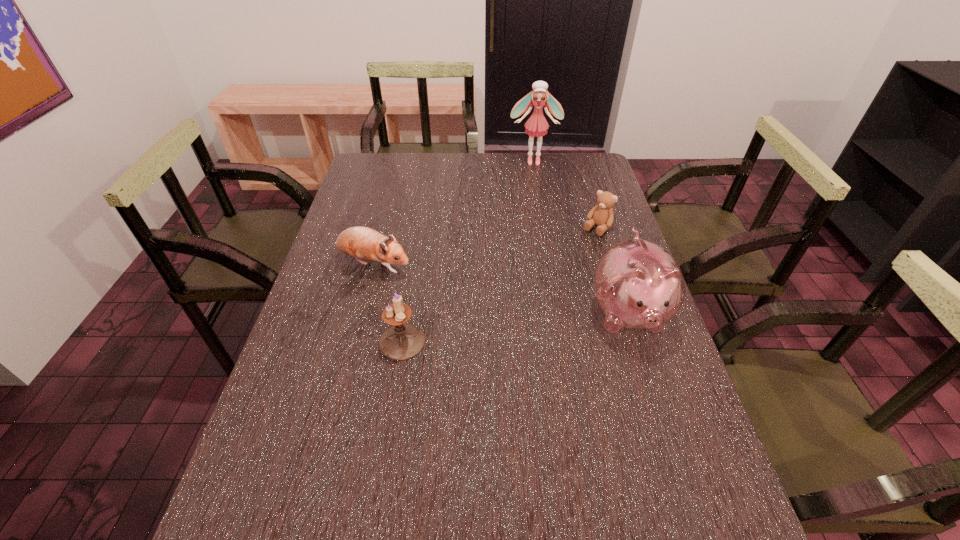
Locate an element on the screen. The image size is (960, 540). vacant spot on the desktop that is between the candle holder and the piggy bank and is positioned at the face of the hamster is located at coordinates (520, 327).

Find the location of a particular element. The width and height of the screenshot is (960, 540). free spot on the desktop that is between the third tallest object and the piggy bank and is positioned on the face of the teddy bear is located at coordinates (504, 329).

Where is `vacant space on the desktop that is between the third shortest object and the piggy bank and is positioned on the front-facing side of the farthest object`? This screenshot has height=540, width=960. vacant space on the desktop that is between the third shortest object and the piggy bank and is positioned on the front-facing side of the farthest object is located at coordinates (543, 325).